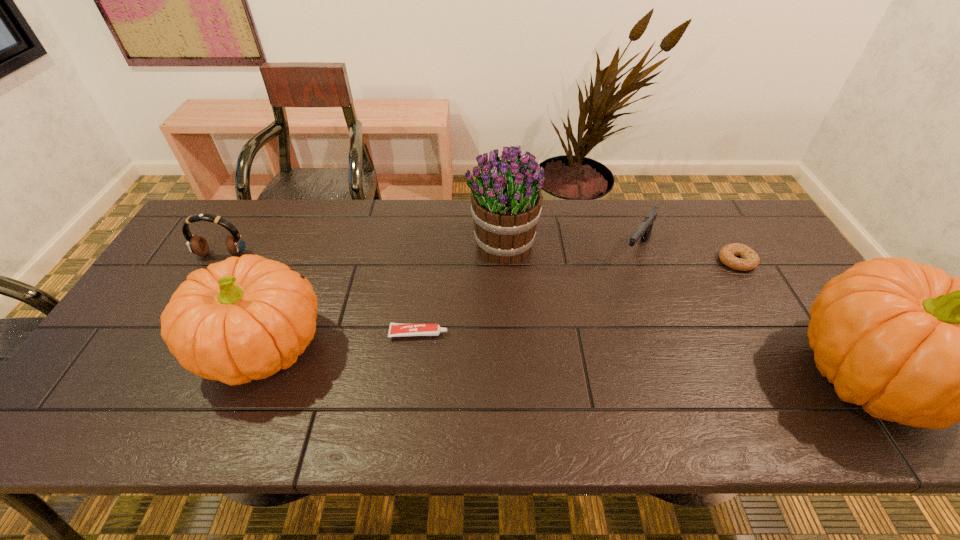
The image size is (960, 540). I want to click on the third tallest object, so click(x=244, y=318).

Image resolution: width=960 pixels, height=540 pixels. What are the coordinates of `the sixth object from right to left` in the screenshot? It's located at (244, 318).

Where is `the third shortest object`? the third shortest object is located at coordinates (644, 230).

Locate an element on the screen. Image resolution: width=960 pixels, height=540 pixels. the third object from right to left is located at coordinates (644, 230).

At what (x,y) coordinates should I click in order to perform the action: click on the fourth object from right to left. Please return your answer as a coordinate pair (x, y). This screenshot has height=540, width=960. Looking at the image, I should click on (506, 198).

Identify the location of the fourth shortest object. (197, 244).

Find the location of a particular element. The width and height of the screenshot is (960, 540). headset is located at coordinates (197, 244).

Find the location of a particular element. This screenshot has width=960, height=540. bagel is located at coordinates (749, 260).

Find the location of a particular element. The image size is (960, 540). toothpaste is located at coordinates (396, 329).

Identify the location of the fifth object from right to left. This screenshot has width=960, height=540. (396, 329).